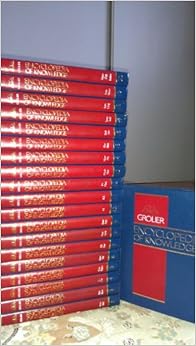
This screenshot has height=346, width=196. Identify the location of red book spin. (84, 74), (80, 185), (82, 259), (81, 221), (84, 304).